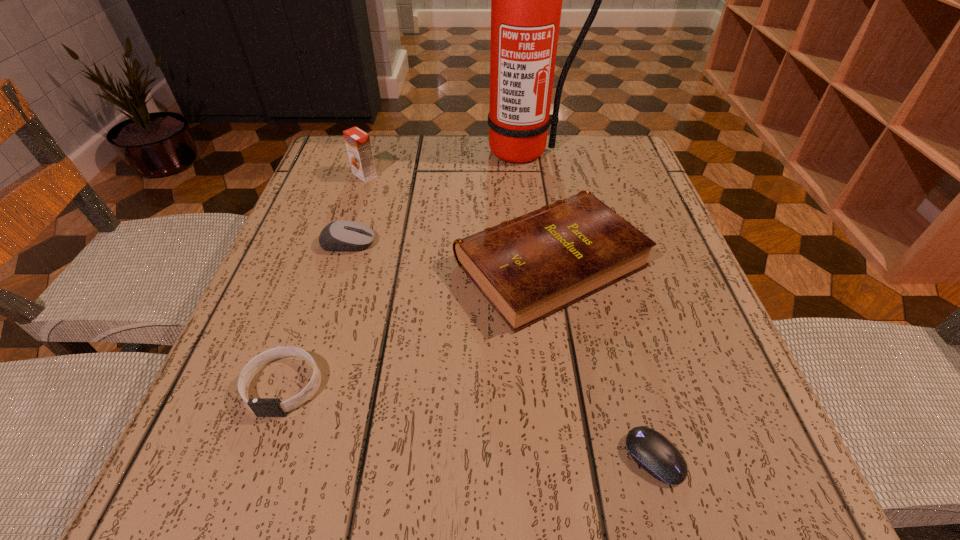
In the image, there is a desktop. Identify the location of blank space at the left edge. (329, 372).

Identify the location of free space at the right edge of the desktop. (636, 222).

Find the location of a particular element. blank area at the far right corner is located at coordinates (595, 141).

Image resolution: width=960 pixels, height=540 pixels. Find the location of `vacant region at the near right corner of the desktop`. vacant region at the near right corner of the desktop is located at coordinates (731, 439).

In order to click on free space between the second farthest object and the farther computer mouse in this screenshot , I will do `click(356, 209)`.

Locate an element on the screen. The image size is (960, 540). free space between the tallest object and the fourth shortest object is located at coordinates pos(537,207).

Where is `free space between the fourth shortest object and the nearer computer mouse`? free space between the fourth shortest object and the nearer computer mouse is located at coordinates (602, 360).

Where is `unoccupied area between the taller computer mouse and the wristband`? The width and height of the screenshot is (960, 540). unoccupied area between the taller computer mouse and the wristband is located at coordinates (316, 314).

The height and width of the screenshot is (540, 960). I want to click on free spot between the taller computer mouse and the fifth nearest object, so click(x=356, y=209).

The image size is (960, 540). Identify the location of free point between the orange juice and the fourth shortest object. (457, 219).